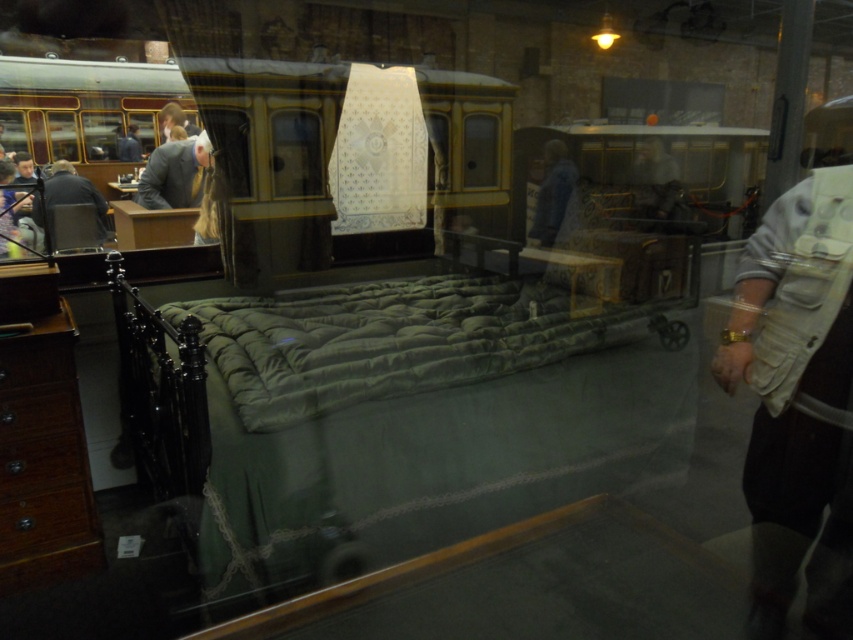
Question: Is wooden drawer at lower left to the left of blue denim jacket at center from the viewer's perspective?

Choices:
 (A) yes
 (B) no

Answer: (A)

Question: Which of these objects is positioned farthest from the blue denim jacket at center?

Choices:
 (A) brown wood dresser at lower left
 (B) wooden drawer at lower left
 (C) dark gray fabric jacket at left
 (D) gray wool suit at center

Answer: (C)

Question: Is white fabric at right positioned before gray wool suit at center?

Choices:
 (A) no
 (B) yes

Answer: (B)

Question: Is white fabric at right thinner than blue denim jacket at center?

Choices:
 (A) yes
 (B) no

Answer: (A)

Question: Which object is positioned farthest from the green fabric bed at center?

Choices:
 (A) dark gray fabric jacket at left
 (B) white fabric at right
 (C) brown wood dresser at lower left
 (D) wooden drawer at lower left

Answer: (A)

Question: Which of the following is the closest to the observer?

Choices:
 (A) wooden drawer at lower left
 (B) blue denim jacket at center

Answer: (A)